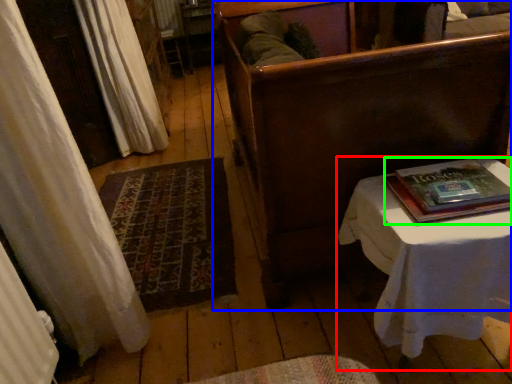
Question: Estimate the real-world distances between objects in this image. Which object is farther from table (highlighted by a red box), furniture (highlighted by a blue box) or paperback book (highlighted by a green box)?

Choices:
 (A) furniture
 (B) paperback book

Answer: (A)